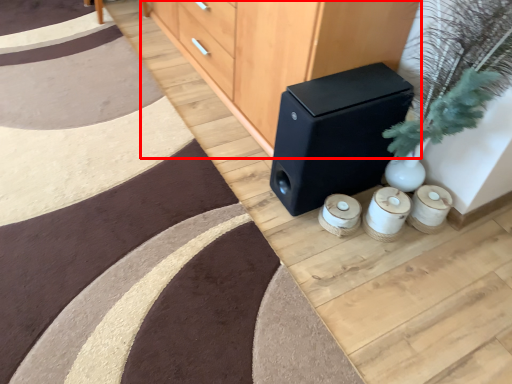
Question: In this image, where is furniture (annotated by the red box) located relative to speaker?

Choices:
 (A) right
 (B) left

Answer: (B)